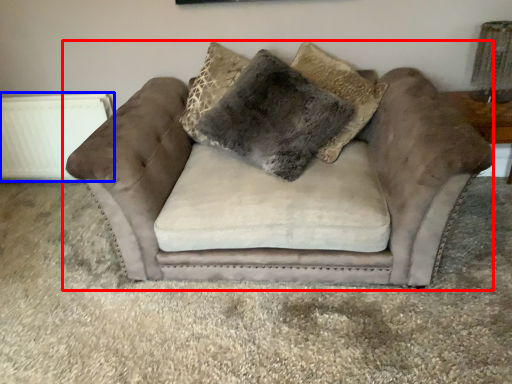
Question: Which of the following is the closest to the observer, studio couch (highlighted by a red box) or radiator (highlighted by a blue box)?

Choices:
 (A) studio couch
 (B) radiator

Answer: (A)